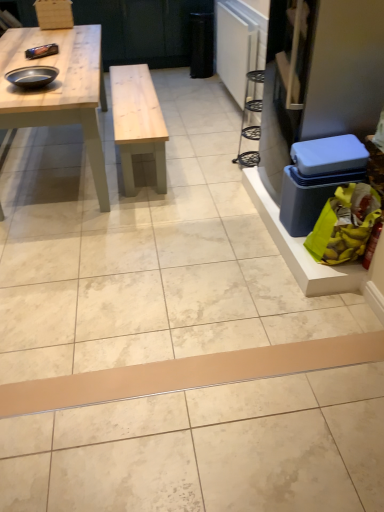
In order to click on vacant space to the right of light wood table at upper left in this screenshot , I will do `click(201, 158)`.